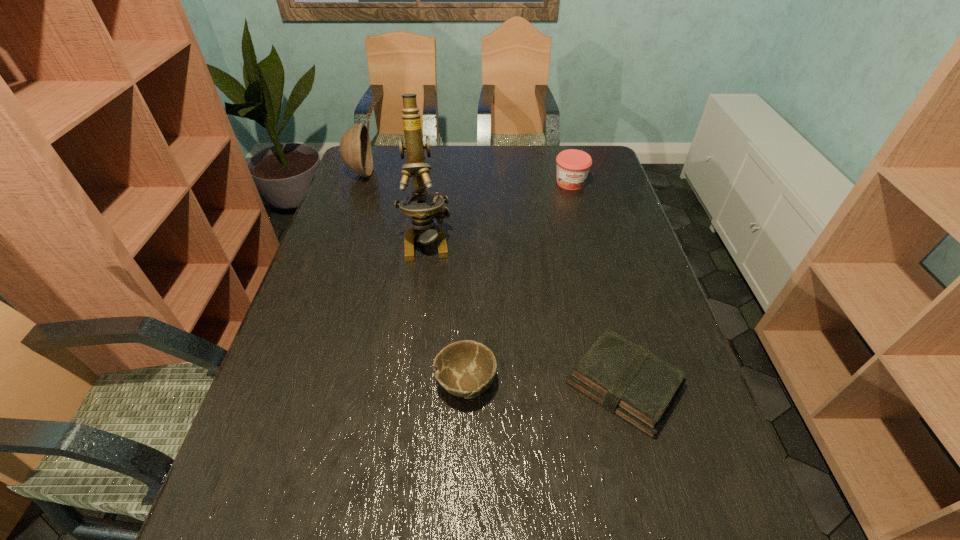
Identify the location of free spot between the jam and the fourth shortest object. pos(466,178).

Where is `vacant area that lies between the microscope and the book`? The width and height of the screenshot is (960, 540). vacant area that lies between the microscope and the book is located at coordinates (x=525, y=312).

Find the location of a particular element. vacant area that lies between the nearer bowl and the fourth shortest object is located at coordinates (413, 278).

Locate which object ranks third in proximity to the jam. Please provide its 2D coordinates. Your answer should be formatted as a tuple, i.e. [(x, y)], where the tuple contains the x and y coordinates of a point satisfying the conditions above.

[(355, 148)]

Find the location of a particular element. object that is the closest to the left bowl is located at coordinates (423, 207).

Locate an element on the screen. The image size is (960, 540). free space that satisfies the following two spatial constraints: 1. on the front side of the leftmost object; 2. on the right side of the shortest object is located at coordinates (285, 384).

Identify the location of vacant space that satisfies the following two spatial constraints: 1. on the front side of the shortest object; 2. on the left side of the fourth shortest object. Image resolution: width=960 pixels, height=540 pixels. (285, 384).

This screenshot has height=540, width=960. Identify the location of free spot that satisfies the following two spatial constraints: 1. on the front label of the book; 2. on the left side of the jam. (623, 384).